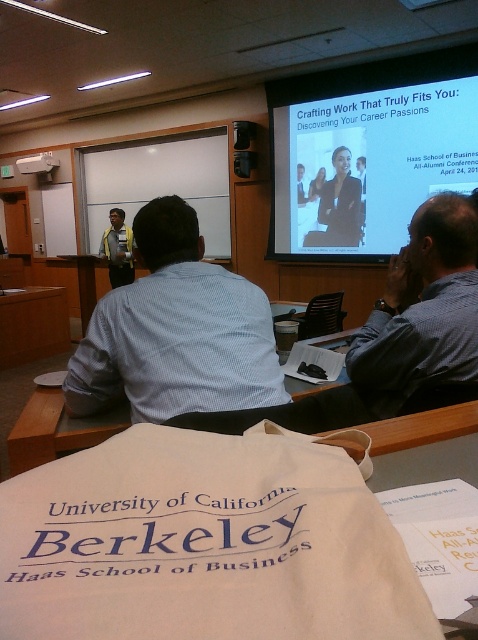
Question: Is blue shirt at upper center further to the viewer compared to white plastic projector at upper center?

Choices:
 (A) no
 (B) yes

Answer: (A)

Question: Which of the following is the closest to the observer?

Choices:
 (A) white plastic projector at upper center
 (B) yellow shirt at center
 (C) white matte projector screen at upper center

Answer: (C)

Question: Which object is the farthest from the black suit at center?

Choices:
 (A) blue shirt at upper center
 (B) white fabric bag at center
 (C) yellow shirt at center

Answer: (B)

Question: Which object is farther from the camera taking this photo?

Choices:
 (A) white fabric bag at center
 (B) blue striped shirt at center
 (C) white plastic projector at upper center

Answer: (C)

Question: Is blue shirt at upper center further to camera compared to white fabric bag at center?

Choices:
 (A) yes
 (B) no

Answer: (A)

Question: Can you confirm if white fabric bag at center is positioned below black suit at center?

Choices:
 (A) yes
 (B) no

Answer: (A)